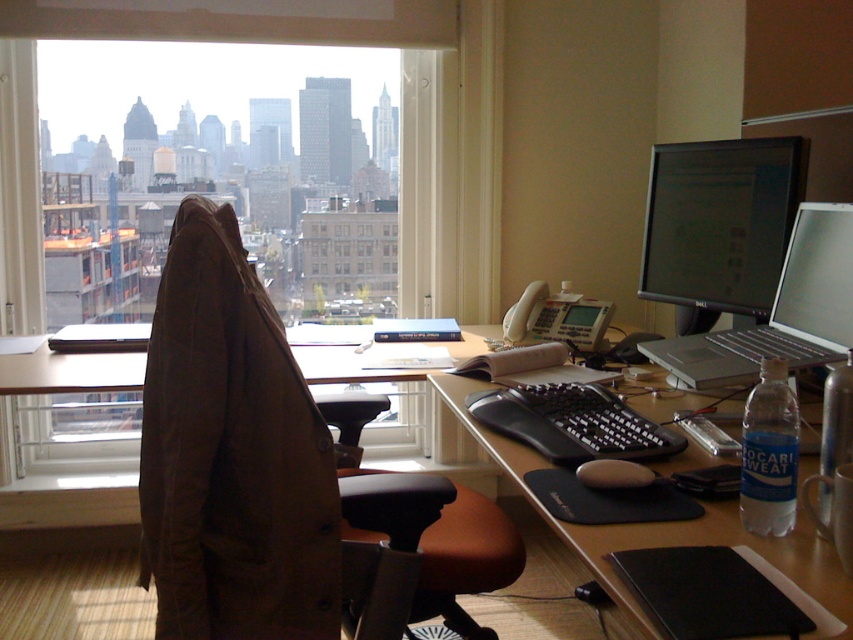
You are a delivery robot that needs to deliver a package to the desk. The package is 2 meters long. You see the black glossy monitor at upper right. Can you fit the package on the desk without touching the monitor?

The distance of black glossy monitor at upper right from camera is 1.87 meters. Since the package is 2 meters long, it would extend beyond the monitor and may not fit without touching it. However, the desk dimensions aren not provided, so we can only confirm the monitor is closer than the package length.